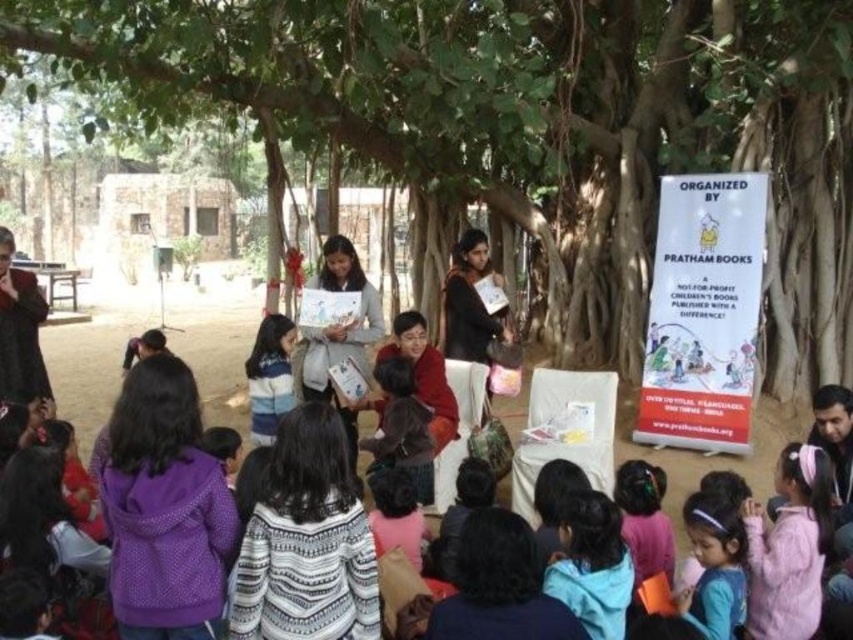
You are standing at the camera position and want to reach the point marked at coordinates point (x=474, y=1). How far will you have to walk to get there?

The distance of point (x=474, y=1) from camera is 31.02 meters, so you will have to walk 31.02 meters to reach it.

You are a photographer trying to capture a photo of the purple fleece jacket at lower left without including the green leafy tree at center in the frame. Is this possible based on their positions?

The green leafy tree at center is positioned over the purple fleece jacket at lower left, so it is likely blocking the view. Therefore, capturing the jacket without the tree in the frame might not be possible unless you move to a different angle or position where the tree is out of the shot.

You are a photographer trying to capture the entire scene of the outdoor educational event. You notice the green leafy tree at center and the purple fleece jacket at lower left. Based on their sizes in the image, which object would require you to step back further to include both in the frame?

The green leafy tree at center has a larger width than the purple fleece jacket at lower left, so you would need to step back further to include both in the frame because the tree is wider.